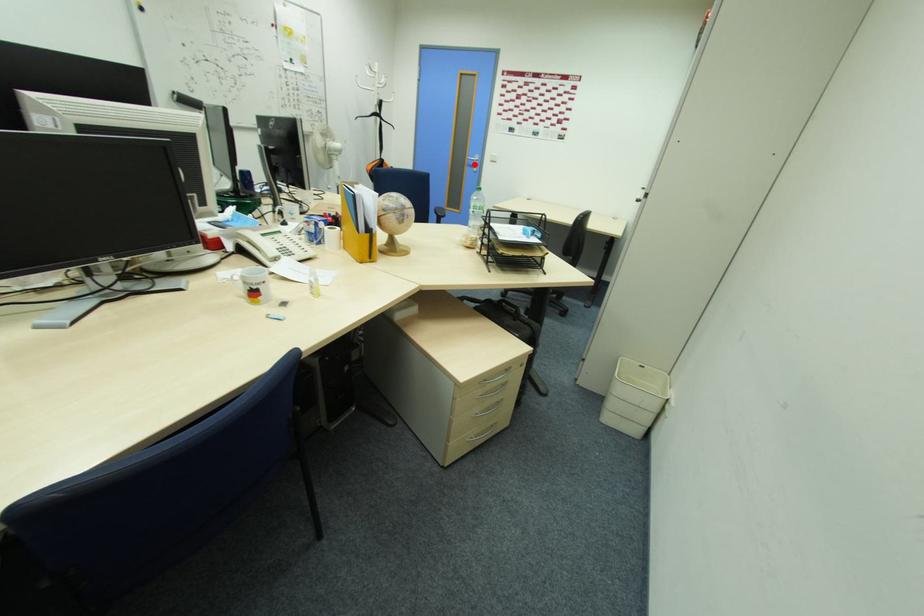
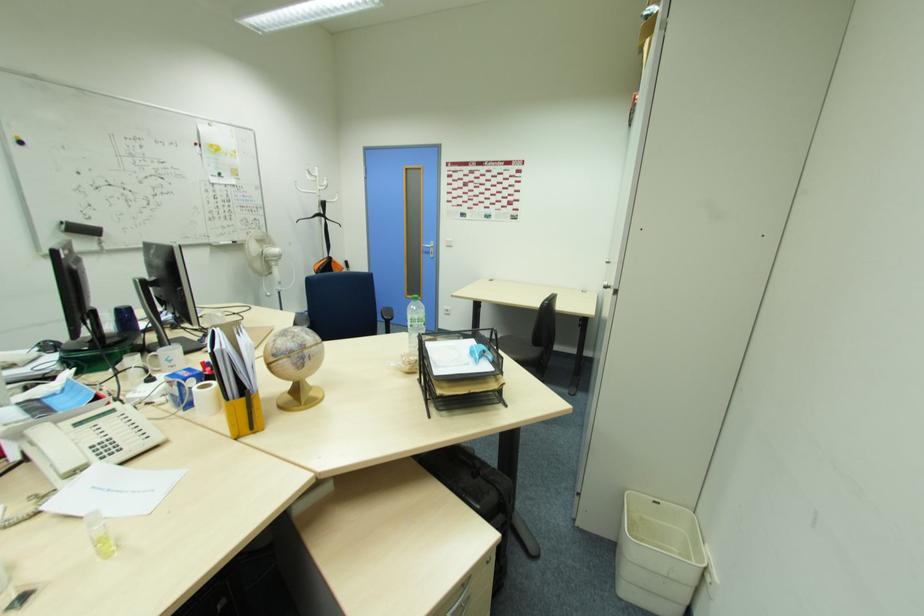
Locate, in the second image, the point that corresponds to the highlighted location in the first image.

(430, 252)